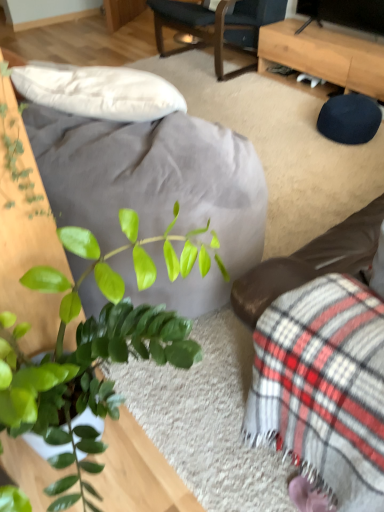
The image size is (384, 512). I want to click on light brown wooden desk at upper right, so click(x=324, y=56).

The width and height of the screenshot is (384, 512). I want to click on plaid fabric couch at lower right, so click(x=310, y=262).

Where is `dark blue fabric chair at upper center`? This screenshot has height=512, width=384. dark blue fabric chair at upper center is located at coordinates (216, 26).

What do you see at coordinates (216, 26) in the screenshot?
I see `dark blue fabric chair at upper center` at bounding box center [216, 26].

Image resolution: width=384 pixels, height=512 pixels. In order to click on light brown wooden desk at upper right in this screenshot , I will do `click(324, 56)`.

Is light brown wooden desk at upper right further to camera compared to dark blue fabric chair at upper center?

No.

From the image's perspective, who appears lower, light brown wooden desk at upper right or dark blue fabric chair at upper center?

light brown wooden desk at upper right is shown below in the image.

Is light brown wooden desk at upper right touching dark blue fabric chair at upper center?

No, light brown wooden desk at upper right is not with dark blue fabric chair at upper center.

The image size is (384, 512). I want to click on chair above the light brown wooden desk at upper right (from a real-world perspective), so click(216, 26).

Does dark blue fabric chair at upper center lie in front of plaid fabric couch at lower right?

No, dark blue fabric chair at upper center is behind plaid fabric couch at lower right.

Is dark blue fabric chair at upper center not close to plaid fabric couch at lower right?

Absolutely, dark blue fabric chair at upper center is distant from plaid fabric couch at lower right.

Considering the relative sizes of dark blue fabric chair at upper center and plaid fabric couch at lower right in the image provided, is dark blue fabric chair at upper center wider than plaid fabric couch at lower right?

Indeed, dark blue fabric chair at upper center has a greater width compared to plaid fabric couch at lower right.

At what (x,y) coordinates should I click in order to perform the action: click on desk behind the plaid fabric couch at lower right. Please return your answer as a coordinate pair (x, y). Looking at the image, I should click on (324, 56).

Is light brown wooden desk at upper right at the back of plaid fabric couch at lower right?

plaid fabric couch at lower right does not have its back to light brown wooden desk at upper right.

Considering the points (308, 250) and (269, 46), which point is in front, point (308, 250) or point (269, 46)?

Positioned in front is point (308, 250).

Is plaid fabric couch at lower right far away from light brown wooden desk at upper right?

plaid fabric couch at lower right is positioned a significant distance from light brown wooden desk at upper right.

Where is `desk that appears below the dark blue fabric chair at upper center (from a real-world perspective)`? Image resolution: width=384 pixels, height=512 pixels. desk that appears below the dark blue fabric chair at upper center (from a real-world perspective) is located at coordinates (324, 56).

Considering the relative sizes of dark blue fabric chair at upper center and light brown wooden desk at upper right in the image provided, is dark blue fabric chair at upper center smaller than light brown wooden desk at upper right?

No, dark blue fabric chair at upper center is not smaller than light brown wooden desk at upper right.

From a real-world perspective, which object rests below the other?

From a 3D spatial view, light brown wooden desk at upper right is below.

Is the surface of dark blue fabric chair at upper center in direct contact with light brown wooden desk at upper right?

No, dark blue fabric chair at upper center is not with light brown wooden desk at upper right.

Can you confirm if light brown wooden desk at upper right is smaller than plaid fabric couch at lower right?

Actually, light brown wooden desk at upper right might be larger than plaid fabric couch at lower right.

Does point (383, 60) lie behind point (296, 253)?

Yes, point (383, 60) is behind point (296, 253).

From the image's perspective, between light brown wooden desk at upper right and plaid fabric couch at lower right, who is located below?

plaid fabric couch at lower right.

From a real-world perspective, is light brown wooden desk at upper right over plaid fabric couch at lower right?

No, from a real-world perspective, light brown wooden desk at upper right is not on top of plaid fabric couch at lower right.

Is plaid fabric couch at lower right outside of dark blue fabric chair at upper center?

Yes.

Considering the relative positions of plaid fabric couch at lower right and dark blue fabric chair at upper center in the image provided, is plaid fabric couch at lower right to the left of dark blue fabric chair at upper center from the viewer's perspective?

Incorrect, plaid fabric couch at lower right is not on the left side of dark blue fabric chair at upper center.

Looking at this image, is plaid fabric couch at lower right positioned in front of dark blue fabric chair at upper center?

Yes, plaid fabric couch at lower right is in front of dark blue fabric chair at upper center.

Locate an element on the screen. desk on the right of dark blue fabric chair at upper center is located at coordinates point(324,56).

Locate an element on the screen. This screenshot has height=512, width=384. chair behind the plaid fabric couch at lower right is located at coordinates (216, 26).

From the image, which object appears to be farther from plaid fabric couch at lower right, dark blue fabric chair at upper center or light brown wooden desk at upper right?

dark blue fabric chair at upper center.

When comparing their distances from light brown wooden desk at upper right, does plaid fabric couch at lower right or dark blue fabric chair at upper center seem further?

plaid fabric couch at lower right is positioned further to the anchor light brown wooden desk at upper right.

When comparing their distances from plaid fabric couch at lower right, does light brown wooden desk at upper right or dark blue fabric chair at upper center seem closer?

light brown wooden desk at upper right is positioned closer to the anchor plaid fabric couch at lower right.

Based on their spatial positions, is plaid fabric couch at lower right or light brown wooden desk at upper right further from dark blue fabric chair at upper center?

Among the two, plaid fabric couch at lower right is located further to dark blue fabric chair at upper center.

In the scene shown: Which object lies nearer to the anchor point light brown wooden desk at upper right, dark blue fabric chair at upper center or plaid fabric couch at lower right?

dark blue fabric chair at upper center is positioned closer to the anchor light brown wooden desk at upper right.

Looking at the image, which one is located further to dark blue fabric chair at upper center, light brown wooden desk at upper right or plaid fabric couch at lower right?

plaid fabric couch at lower right lies further to dark blue fabric chair at upper center than the other object.

Find the location of `desk positioned between plaid fabric couch at lower right and dark blue fabric chair at upper center from near to far`. desk positioned between plaid fabric couch at lower right and dark blue fabric chair at upper center from near to far is located at coordinates (324, 56).